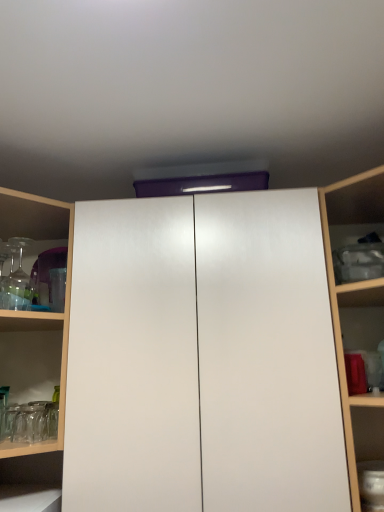
Find the location of `clear glassware at left`. clear glassware at left is located at coordinates (34, 356).

Describe the element at coordinates (34, 356) in the screenshot. The height and width of the screenshot is (512, 384). I see `clear glassware at left` at that location.

The width and height of the screenshot is (384, 512). What do you see at coordinates (279, 347) in the screenshot?
I see `white glossy cupboard at center` at bounding box center [279, 347].

You are a GUI agent. You are given a task and a screenshot of the screen. Output one action in this format:
    pyautogui.click(x=<x>, y=<y>)
    Task: Click on the white glossy cupboard at center
    The width and height of the screenshot is (384, 512).
    Given the screenshot: What is the action you would take?
    pyautogui.click(x=279, y=347)

What is the approximate height of white glossy cupboard at center?

white glossy cupboard at center is 91.87 centimeters tall.

Locate an element on the screen. clear glassware at left is located at coordinates [x=34, y=356].

Is clear glassware at left to the left of white glossy cupboard at center from the viewer's perspective?

Correct, you'll find clear glassware at left to the left of white glossy cupboard at center.

Which object is closer to the camera taking this photo, clear glassware at left or white glossy cupboard at center?

white glossy cupboard at center is closer to the camera.

Is point (32, 497) positioned after point (313, 218)?

No, (32, 497) is closer to viewer.

From the image's perspective, is clear glassware at left above or below white glossy cupboard at center?

clear glassware at left is above white glossy cupboard at center.

From a real-world perspective, is clear glassware at left located beneath white glossy cupboard at center?

No, from a real-world perspective, clear glassware at left is not under white glossy cupboard at center.

Considering the relative sizes of clear glassware at left and white glossy cupboard at center in the image provided, is clear glassware at left wider than white glossy cupboard at center?

Yes.

Looking at this image, is clear glassware at left taller or shorter than white glossy cupboard at center?

Clearly, clear glassware at left is shorter compared to white glossy cupboard at center.

Can you confirm if clear glassware at left is smaller than white glossy cupboard at center?

Yes, clear glassware at left is smaller than white glossy cupboard at center.

Would you say clear glassware at left is inside or outside white glossy cupboard at center?

clear glassware at left is not inside white glossy cupboard at center, it's outside.

Is there a large distance between clear glassware at left and white glossy cupboard at center?

clear glassware at left is near white glossy cupboard at center, not far away.

Could you tell me if clear glassware at left is turned towards white glossy cupboard at center?

No.

What's the angular difference between clear glassware at left and white glossy cupboard at center's facing directions?

45.7 degrees separate the facing orientations of clear glassware at left and white glossy cupboard at center.

This screenshot has height=512, width=384. I want to click on cupboard on the right of clear glassware at left, so click(279, 347).

Which is more to the left, white glossy cupboard at center or clear glassware at left?

clear glassware at left is more to the left.

Does white glossy cupboard at center lie behind clear glassware at left?

No, white glossy cupboard at center is closer to the viewer.

Which is behind, point (349, 287) or point (21, 369)?

Point (21, 369)

From the image's perspective, relative to clear glassware at left, is white glossy cupboard at center above or below?

Based on their image positions, white glossy cupboard at center is located beneath clear glassware at left.

From a real-world perspective, relative to clear glassware at left, is white glossy cupboard at center vertically above or below?

Clearly, from a real-world perspective, white glossy cupboard at center is below clear glassware at left.

Based on the photo, is white glossy cupboard at center wider or thinner than clear glassware at left?

white glossy cupboard at center is thinner than clear glassware at left.

Looking at this image, is white glossy cupboard at center taller or shorter than clear glassware at left?

Considering their sizes, white glossy cupboard at center has more height than clear glassware at left.

Can you confirm if white glossy cupboard at center is smaller than clear glassware at left?

No, white glossy cupboard at center is not smaller than clear glassware at left.

Do you think white glossy cupboard at center is within clear glassware at left, or outside of it?

white glossy cupboard at center exists outside the volume of clear glassware at left.

Is white glossy cupboard at center beside clear glassware at left?

white glossy cupboard at center and clear glassware at left are clearly separated.

Is white glossy cupboard at center looking in the opposite direction of clear glassware at left?

That's not correct — white glossy cupboard at center is not looking away from clear glassware at left.

Locate an element on the screen. Image resolution: width=384 pixels, height=512 pixels. shelf above the white glossy cupboard at center (from the image's perspective) is located at coordinates (34, 356).

Where is `cupboard in front of the clear glassware at left`? This screenshot has height=512, width=384. cupboard in front of the clear glassware at left is located at coordinates (279, 347).

Find the location of a particular element. The height and width of the screenshot is (512, 384). cupboard that is below the clear glassware at left (from the image's perspective) is located at coordinates (279, 347).